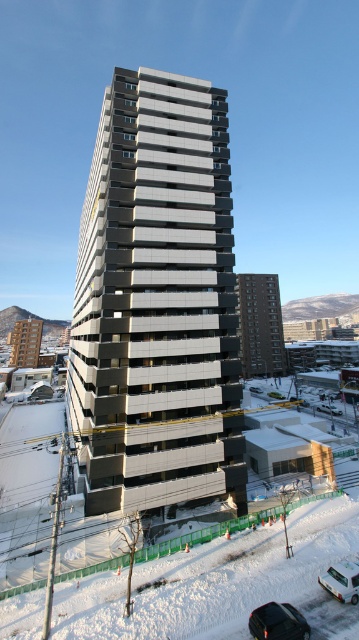
You are standing at the base of the high rise building and want to park your car. You see the black glossy car at lower center and the white matte car at lower right. Which car is closer to you?

The black glossy car at lower center is closer to the viewer than the white matte car at lower right.

You are standing in front of the modern highrise building and want to determine the relative positions of two points marked on the building facade. The points are labeled as point (151,177) and point (168,563). Which of these points is closer to you?

Point (151,177) is closer to you because it is further to the viewer than point (168,563).